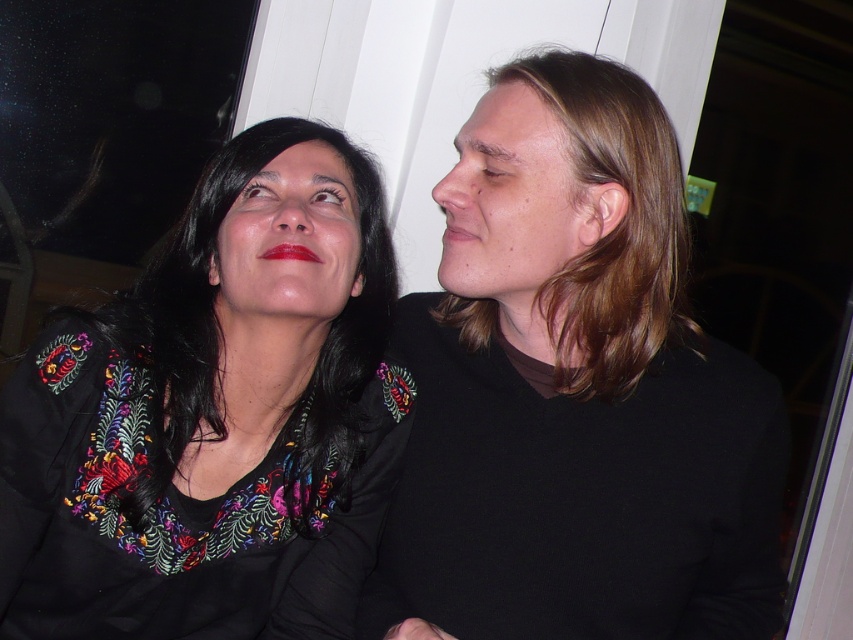
Question: Based on their relative distances, which object is farther from the embroidered fabric blouse at upper left?

Choices:
 (A) blonde hair at upper right
 (B) black embroidered shirt at upper right

Answer: (A)

Question: Which is farther from the blonde hair at upper right?

Choices:
 (A) black embroidered shirt at upper right
 (B) embroidered fabric blouse at upper left

Answer: (B)

Question: Is black embroidered shirt at upper right wider than blonde hair at upper right?

Choices:
 (A) no
 (B) yes

Answer: (B)

Question: Can you confirm if black embroidered shirt at upper right is thinner than blonde hair at upper right?

Choices:
 (A) no
 (B) yes

Answer: (A)

Question: Can you confirm if black embroidered shirt at upper right is positioned to the left of embroidered fabric blouse at upper left?

Choices:
 (A) yes
 (B) no

Answer: (B)

Question: Which point is closer to the camera taking this photo?

Choices:
 (A) (585, 113)
 (B) (316, 540)
 (C) (486, 592)

Answer: (A)